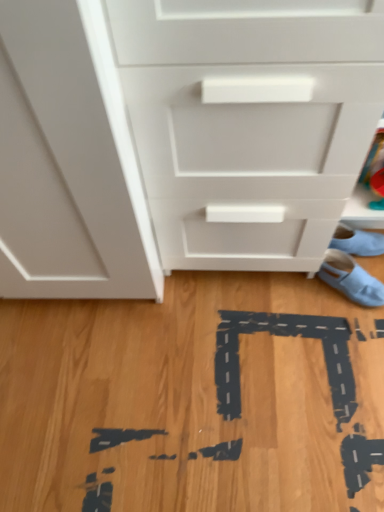
At what (x,y) coordinates should I click in order to perform the action: click on free spot in front of light blue fabric shoe at lower right, marked as the second footwear in a bottom-to-top arrangement. Please return your answer as a coordinate pair (x, y). The width and height of the screenshot is (384, 512). Looking at the image, I should click on (339, 324).